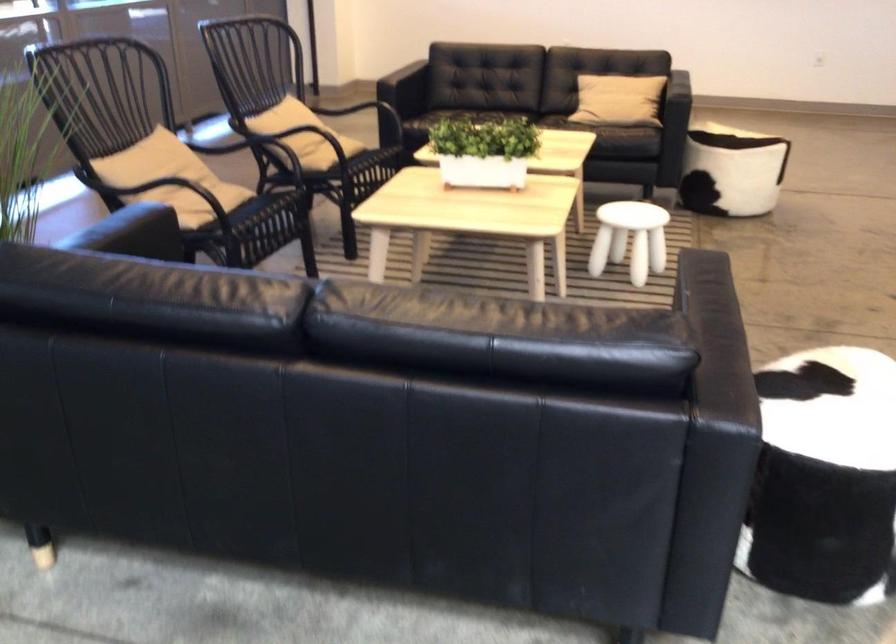
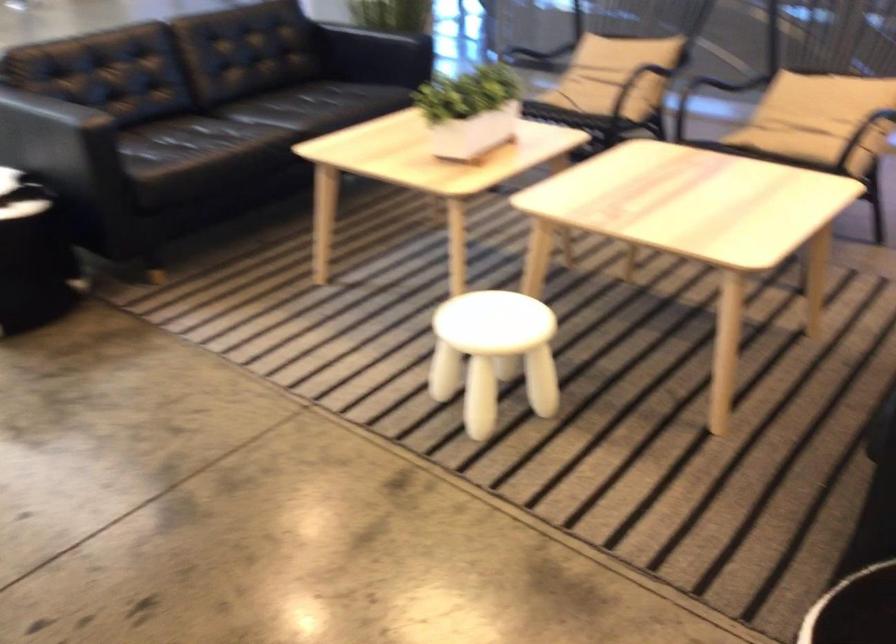
Where in the second image is the point corresponding to [665,212] from the first image?

(493, 354)